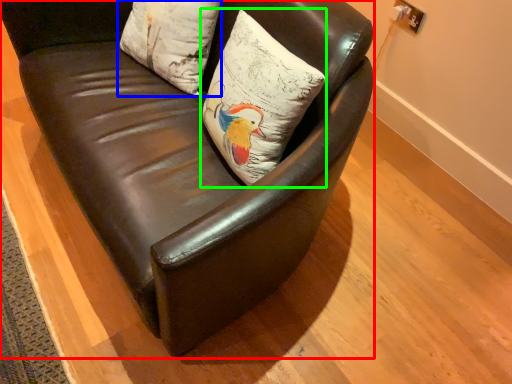
Question: Considering the real-world distances, which object is closest to chair (highlighted by a red box)? pillow (highlighted by a blue box) or pillow (highlighted by a green box).

Choices:
 (A) pillow
 (B) pillow

Answer: (B)